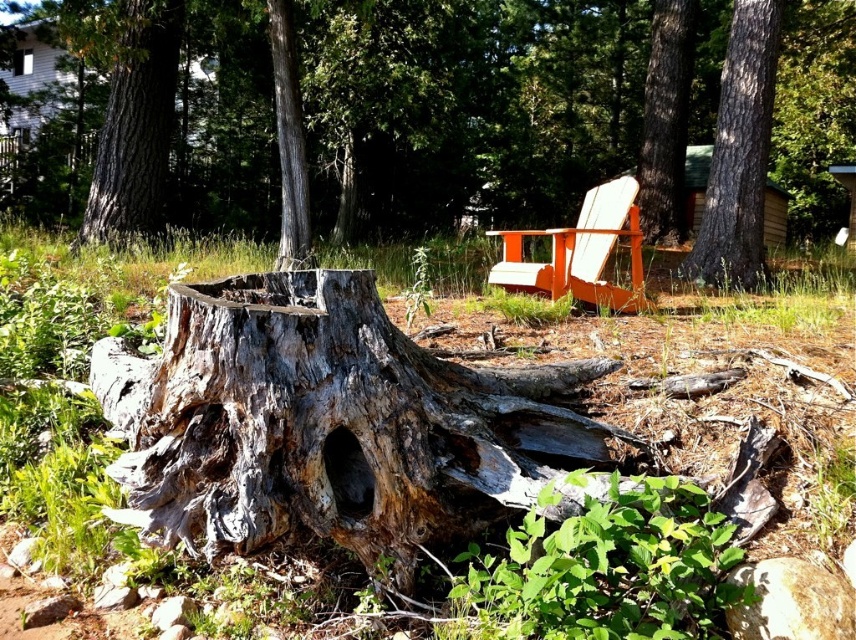
Question: Is orange wood chair at center to the right of smooth brown tree trunk at upper right from the viewer's perspective?

Choices:
 (A) yes
 (B) no

Answer: (B)

Question: Which point is closer to the camera?

Choices:
 (A) (658, 83)
 (B) (256, 161)

Answer: (A)

Question: Which point is closer to the camera?

Choices:
 (A) gray rough bark tree trunk at upper left
 (B) smooth brown tree trunk at upper right
 (C) gray rough bark tree trunk at center
 (D) weathered wood tree stump at center

Answer: (D)

Question: Is weathered wood tree stump at center smaller than orange wood chair at center?

Choices:
 (A) no
 (B) yes

Answer: (A)

Question: In this image, where is smooth bark tree trunk at center located relative to gray rough bark tree trunk at center?

Choices:
 (A) right
 (B) left

Answer: (A)

Question: Which of the following is the farthest from the observer?

Choices:
 (A) (592, 218)
 (B) (736, 64)
 (C) (305, 252)
 (D) (111, 179)

Answer: (D)